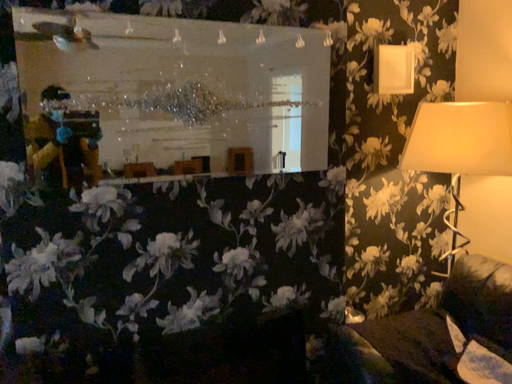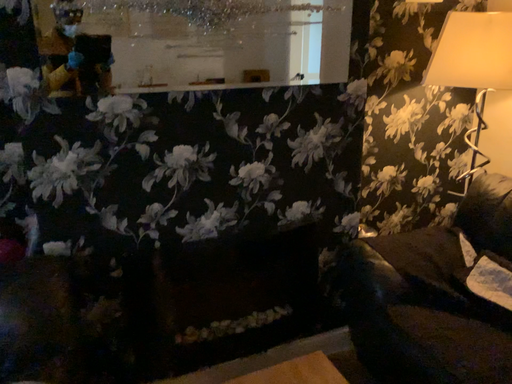
Question: Which way did the camera rotate in the video?

Choices:
 (A) rotated upward
 (B) rotated downward

Answer: (B)